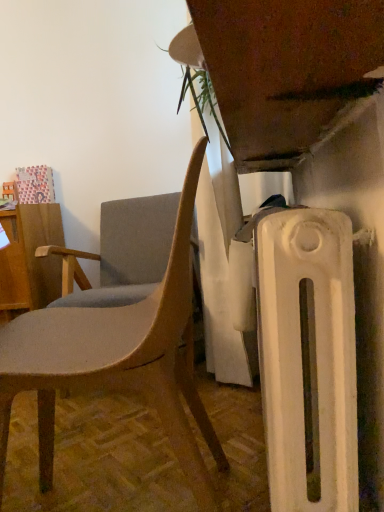
Question: Is matte gray chair at center, the first chair from the front, thinner than matte gray fabric chair at left, positioned as the 2th chair in front-to-back order?

Choices:
 (A) no
 (B) yes

Answer: (B)

Question: Is matte gray chair at center, the first chair from the front, directly adjacent to matte gray fabric chair at left, positioned as the 2th chair in front-to-back order?

Choices:
 (A) yes
 (B) no

Answer: (B)

Question: From the image's perspective, is matte gray chair at center, which is the 2th chair in back-to-front order, above matte gray fabric chair at left, arranged as the first chair when viewed from the back?

Choices:
 (A) yes
 (B) no

Answer: (B)

Question: From the image's perspective, is matte gray chair at center, the first chair from the front, beneath matte gray fabric chair at left, arranged as the first chair when viewed from the back?

Choices:
 (A) no
 (B) yes

Answer: (B)

Question: Is matte gray chair at center, the first chair from the front, far away from matte gray fabric chair at left, positioned as the 2th chair in front-to-back order?

Choices:
 (A) no
 (B) yes

Answer: (A)

Question: Would you say wooden desk at left is inside or outside matte gray chair at center, the first chair from the front?

Choices:
 (A) outside
 (B) inside

Answer: (A)

Question: In the image, is wooden desk at left positioned in front of or behind matte gray chair at center, the first chair from the front?

Choices:
 (A) front
 (B) behind

Answer: (B)

Question: Is wooden desk at left wider or thinner than matte gray chair at center, the first chair from the front?

Choices:
 (A) wide
 (B) thin

Answer: (B)

Question: From a real-world perspective, is wooden desk at left above or below matte gray chair at center, which is the 2th chair in back-to-front order?

Choices:
 (A) below
 (B) above

Answer: (B)

Question: Is matte gray fabric chair at left, arranged as the first chair when viewed from the back, inside the boundaries of matte gray chair at center, the first chair from the front, or outside?

Choices:
 (A) outside
 (B) inside

Answer: (A)

Question: Based on their positions, is matte gray fabric chair at left, arranged as the first chair when viewed from the back, located to the left or right of matte gray chair at center, which is the 2th chair in back-to-front order?

Choices:
 (A) right
 (B) left

Answer: (B)

Question: Considering their positions, is matte gray fabric chair at left, positioned as the 2th chair in front-to-back order, located in front of or behind matte gray chair at center, which is the 2th chair in back-to-front order?

Choices:
 (A) behind
 (B) front

Answer: (A)

Question: Considering the positions of matte gray fabric chair at left, arranged as the first chair when viewed from the back, and matte gray chair at center, the first chair from the front, in the image, is matte gray fabric chair at left, arranged as the first chair when viewed from the back, taller or shorter than matte gray chair at center, the first chair from the front,?

Choices:
 (A) tall
 (B) short

Answer: (B)

Question: From their relative heights in the image, would you say matte gray chair at center, the first chair from the front, is taller or shorter than matte gray fabric chair at left, positioned as the 2th chair in front-to-back order?

Choices:
 (A) short
 (B) tall

Answer: (B)

Question: Is matte gray chair at center, the first chair from the front, wider or thinner than matte gray fabric chair at left, positioned as the 2th chair in front-to-back order?

Choices:
 (A) wide
 (B) thin

Answer: (B)